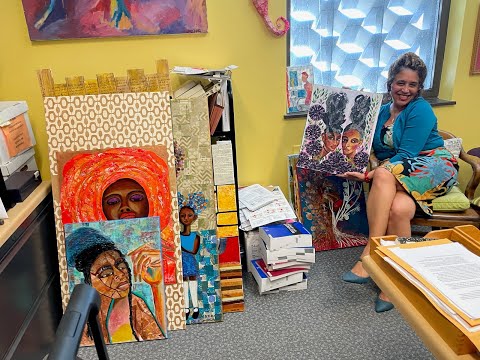
Locate an element on the screen. This screenshot has height=360, width=480. carpet is located at coordinates (303, 330).